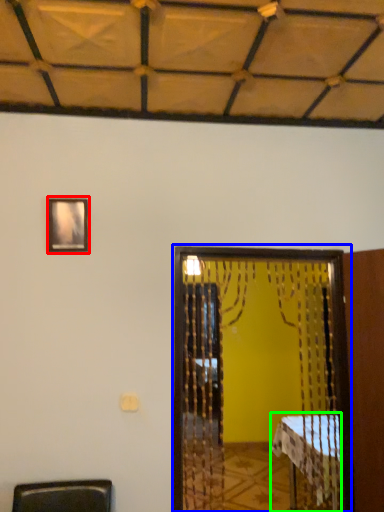
Question: Which object is positioned farthest from picture frame (highlighted by a red box)? Select from screen door (highlighted by a blue box) and table (highlighted by a green box).

Choices:
 (A) screen door
 (B) table

Answer: (B)